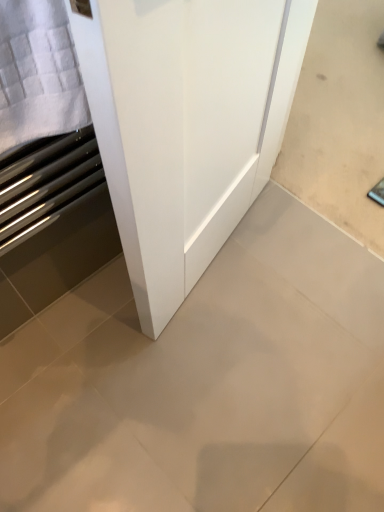
Locate an element on the screen. This screenshot has height=512, width=384. vacant space situated above matte gray tile at center (from a real-world perspective) is located at coordinates (227, 354).